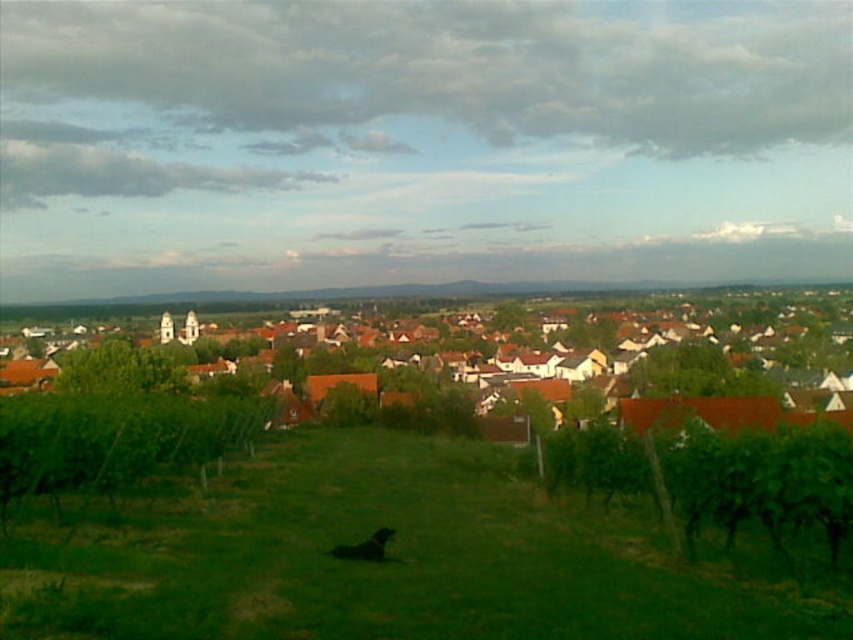
Between green grassy field at center and brown tiled roofs at center, which one appears on the left side from the viewer's perspective?

brown tiled roofs at center is more to the left.

Does green grassy field at center have a lesser width compared to brown tiled roofs at center?

Correct, green grassy field at center's width is less than brown tiled roofs at center's.

The width and height of the screenshot is (853, 640). I want to click on green grassy field at center, so click(387, 556).

At what (x,y) coordinates should I click in order to perform the action: click on green grassy field at center. Please return your answer as a coordinate pair (x, y). Looking at the image, I should click on (387, 556).